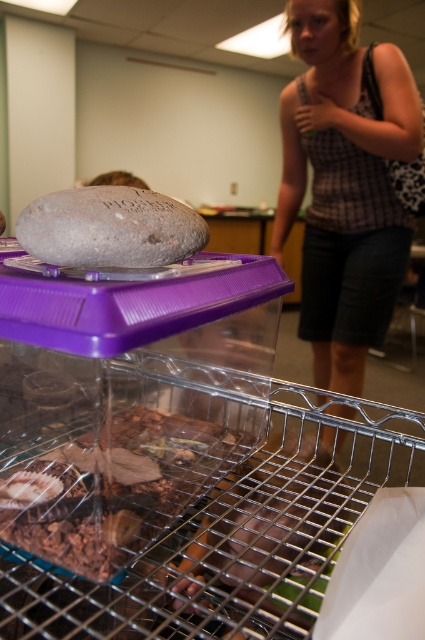
Does point (286, 186) lie behind point (107, 508)?

That is True.

Does point (357, 252) come closer to viewer compared to point (112, 529)?

No, it is not.

Between point (337, 385) and point (79, 477), which one is positioned behind?

The point (337, 385) is more distant.

Locate an element on the screen. plaid fabric tank top at upper right is located at coordinates (343, 186).

Does plaid fabric tank top at upper right lie behind gray matte rock at upper left?

Yes.

Based on the photo, who is lower down, plaid fabric tank top at upper right or gray matte rock at upper left?

Positioned lower is gray matte rock at upper left.

You are a GUI agent. You are given a task and a screenshot of the screen. Output one action in this format:
    pyautogui.click(x=<x>, y=<y>)
    Task: Click on the plaid fabric tank top at upper right
    The image size is (425, 640).
    Given the screenshot: What is the action you would take?
    pyautogui.click(x=343, y=186)

Is brown textured wood at center taller than gray matte rock at upper left?

Yes, brown textured wood at center is taller than gray matte rock at upper left.

Between point (105, 545) and point (189, 225), which one is positioned behind?

Point (189, 225)

At what (x,y) coordinates should I click in order to perform the action: click on brown textured wood at center. Please return your answer as a coordinate pair (x, y). Looking at the image, I should click on (115, 486).